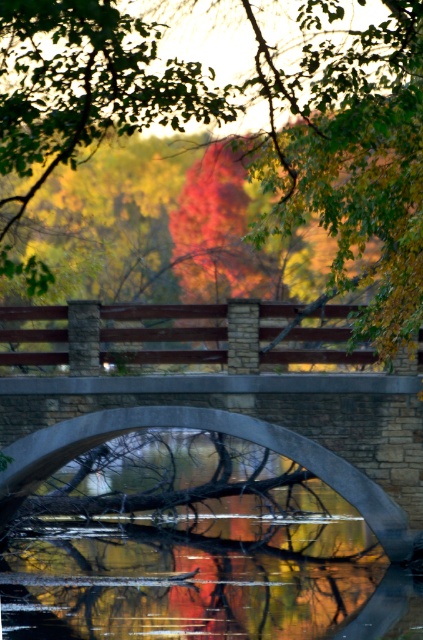
Between reddish-brown wood bridge at center and stone bridge at center, which one is positioned higher?

reddish-brown wood bridge at center is higher up.

Measure the distance between point (390, 86) and camera.

The distance of point (390, 86) from camera is 14.20 meters.

What do you see at coordinates (349, 148) in the screenshot?
I see `reddish-brown wood bridge at center` at bounding box center [349, 148].

Where is `reddish-brown wood bridge at center`? reddish-brown wood bridge at center is located at coordinates (349, 148).